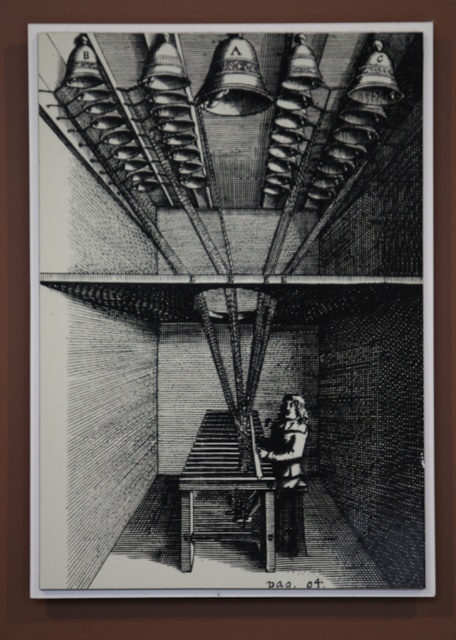
You are standing at the lower section of the image and want to place a new object exactly where the dark brown wood figure at center is located. What are the coordinates of the point where you should place the new object?

The coordinates for the dark brown wood figure at center are at point (286, 461), so you should place the new object at those coordinates.

You are an observer looking at the image. There is a dark brown wood figure at center and a wooden stool at center. Which object is closer to you?

The dark brown wood figure at center is closer to the viewer than the wooden stool at center.